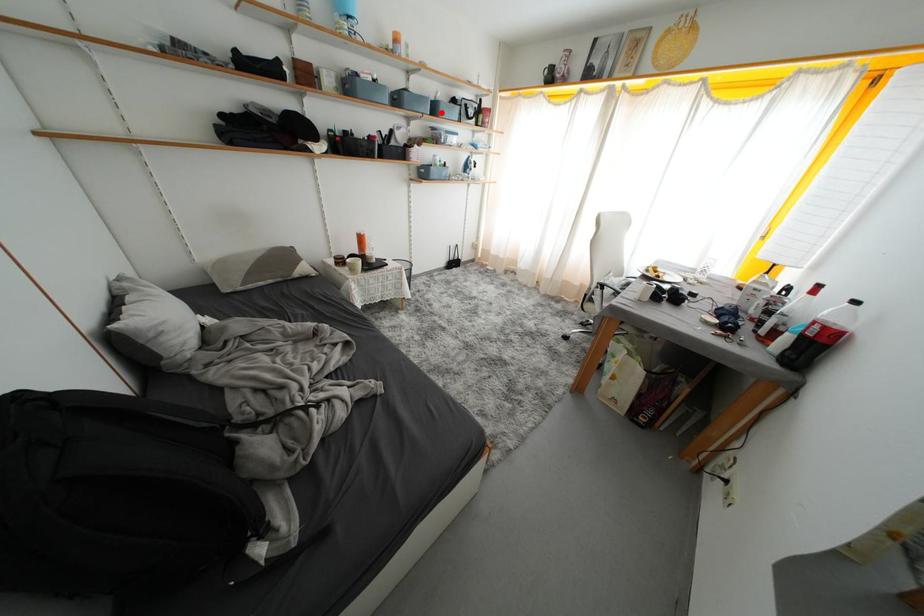
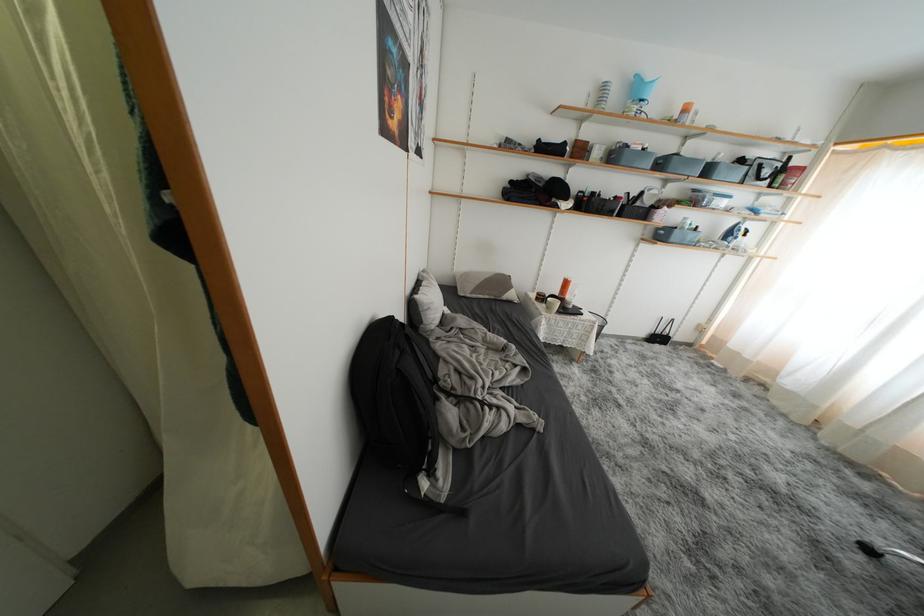
Where in the second image is the point corresponding to the highlighted location from the first image?

(714, 175)